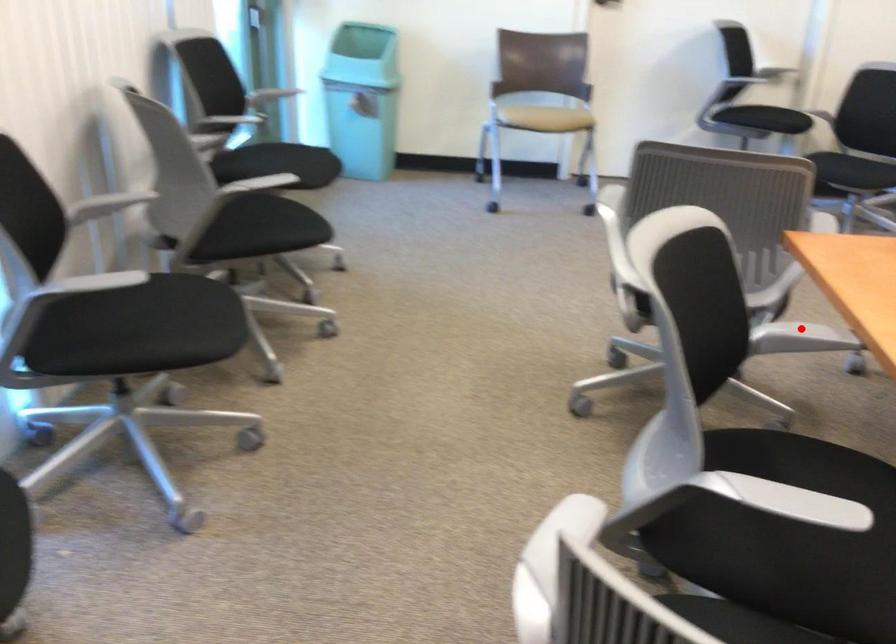
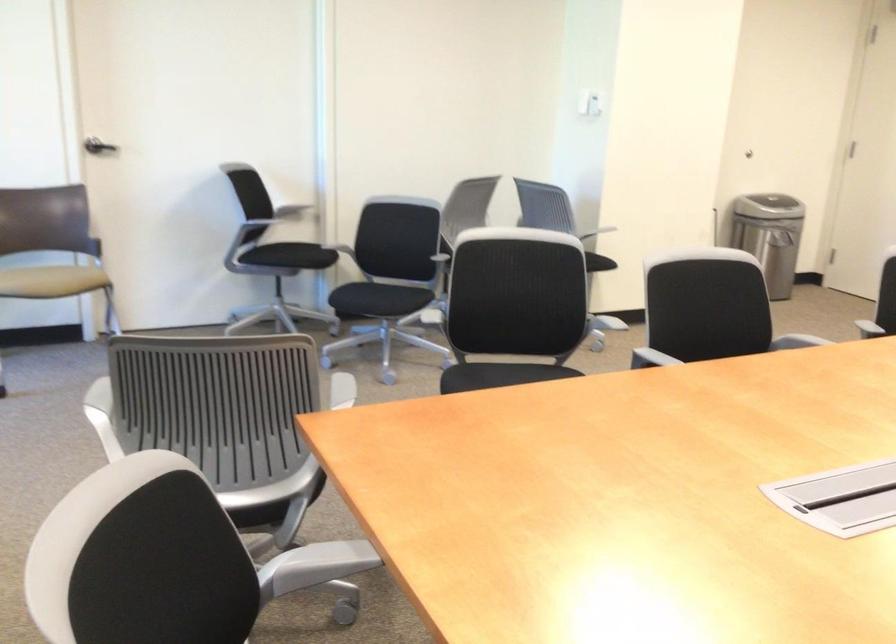
Question: I am providing you with two images of the same scene from different viewpoints. In image1, a red point is highlighted. Considering the same 3D point in image2, which of the following is correct?

Choices:
 (A) It is closer
 (B) It is farther

Answer: (A)